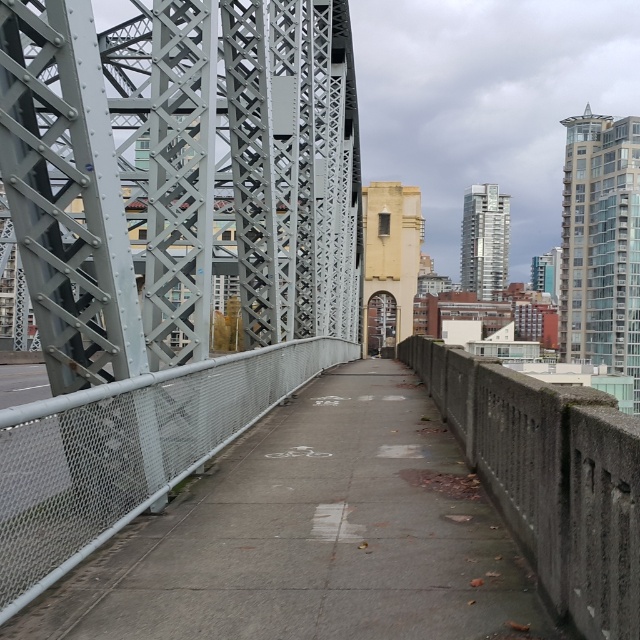
You are a city planner evaluating the bridge structure. You notice the metallic gray bridge at center and the gray concrete pavement at center. Which of these two objects is bigger in size?

The metallic gray bridge at center has a larger size compared to the gray concrete pavement at center.

You are a delivery person carrying a large box that is 2 meters wide. You need to cross the bridge while staying within the walkway. Can your box fit between the metallic gray bridge at center and the gray concrete pavement at center?

The metallic gray bridge at center is wider than the gray concrete pavement at center. However, the exact width of the walkway isn t specified. Since your box is 2 meters wide, you should check if the distance between the two structures is at least 2 meters before proceeding.

In the scene shown: You are a maintenance worker needing to inspect the metallic gray bridge at center and the gray concrete pavement at center. Based on their positions, which one should you check first if you are approaching from the right side of the walkway?

You should check the gray concrete pavement at center first because the metallic gray bridge at center is to the left of it, so the gray concrete pavement at center is closer when approaching from the right side.